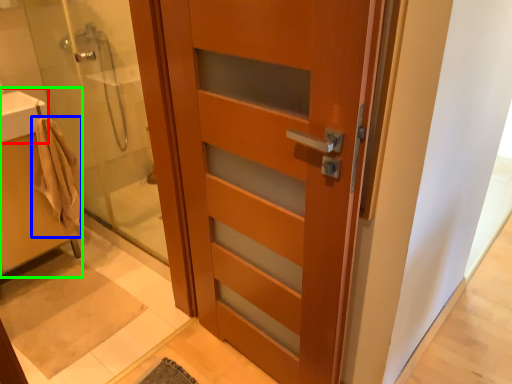
Question: Considering the real-world distances, which object is closest to sink (highlighted by a red box)? bathrobe (highlighted by a blue box) or sink (highlighted by a green box).

Choices:
 (A) bathrobe
 (B) sink

Answer: (A)